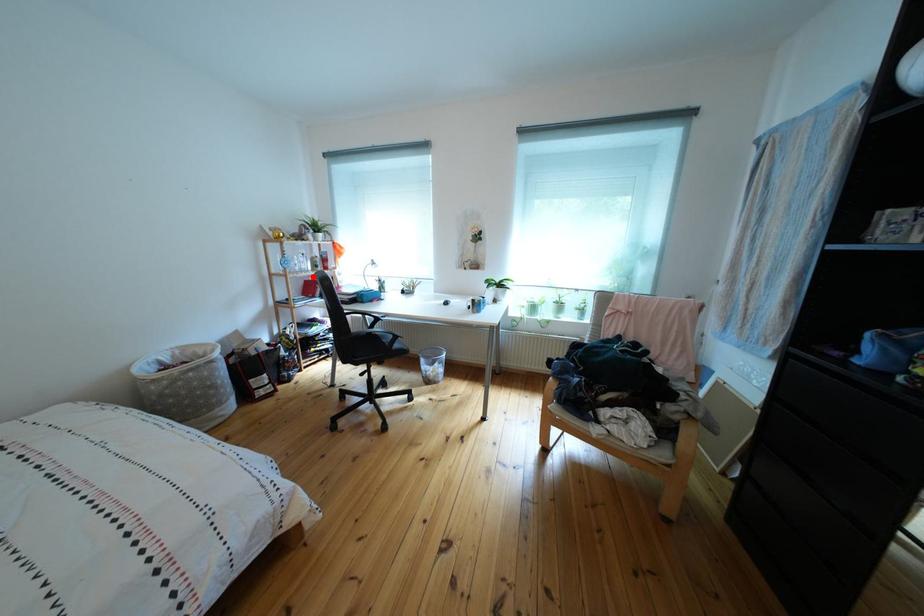
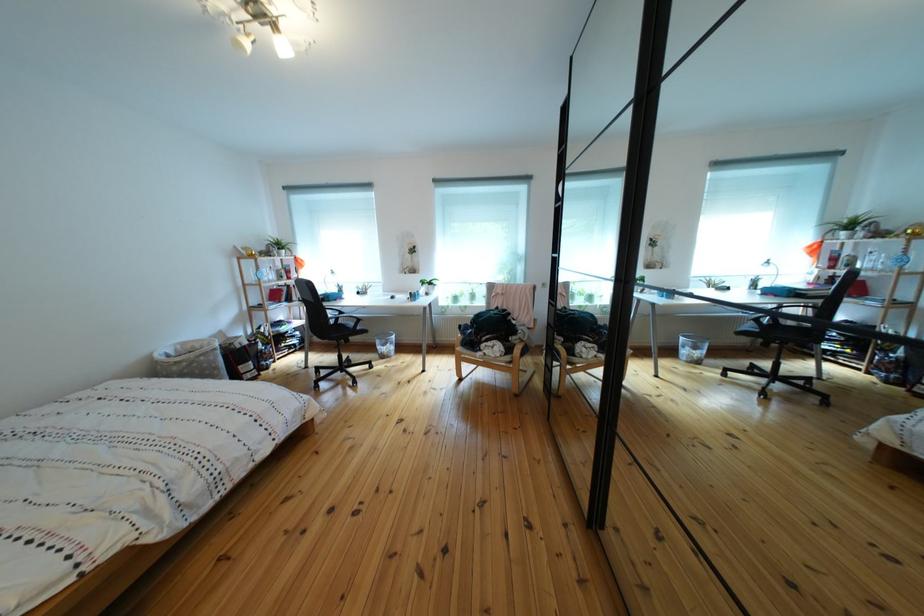
Find the pixel in the second image that matches the highlighted location in the first image.

(282, 286)